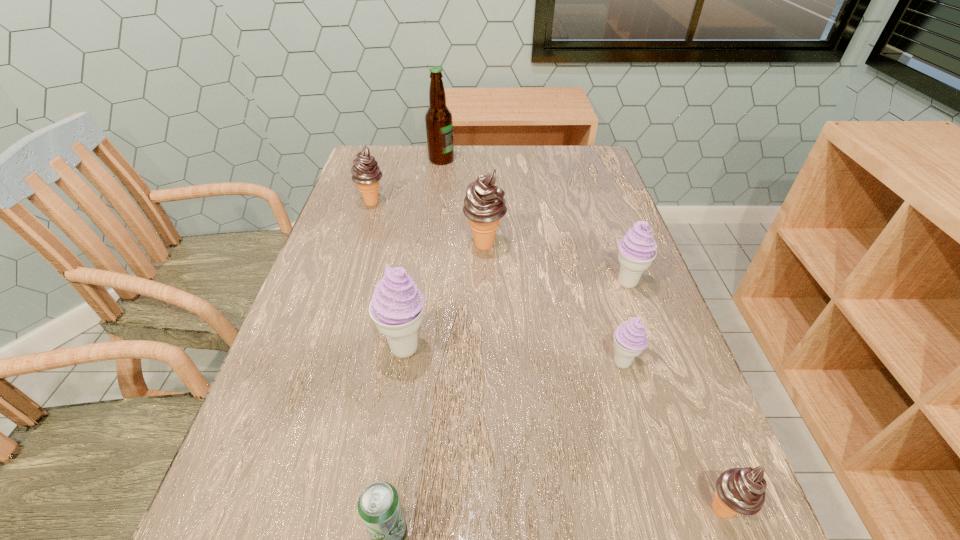
You are a GUI agent. You are given a task and a screenshot of the screen. Output one action in this format:
    pyautogui.click(x=<x>, y=<y>)
    Task: Click on the free point between the biggest chocolate icecream and the leftmost chocolate icecream
    This screenshot has height=540, width=960.
    Given the screenshot: What is the action you would take?
    pyautogui.click(x=428, y=224)

This screenshot has height=540, width=960. In order to click on vacant area that lies between the nearest icecream and the leftmost object in this screenshot , I will do `click(547, 356)`.

Choose which object is the second nearest neighbor to the third farthest icecream. Please provide its 2D coordinates. Your answer should be formatted as a tuple, i.e. [(x, y)], where the tuple contains the x and y coordinates of a point satisfying the conditions above.

[(484, 205)]

Image resolution: width=960 pixels, height=540 pixels. What are the coordinates of `the fourth closest object relative to the farthest purple icecream` in the screenshot? It's located at (738, 490).

Identify which icecream is located as the fifth nearest to the smallest purple icecream. Please provide its 2D coordinates. Your answer should be formatted as a tuple, i.e. [(x, y)], where the tuple contains the x and y coordinates of a point satisfying the conditions above.

[(366, 173)]

What are the coordinates of `icecream that is the third closest to the beer can` in the screenshot? It's located at (738, 490).

This screenshot has width=960, height=540. I want to click on the second closest chocolate icecream to the leftmost icecream, so click(x=738, y=490).

Identify which chocolate icecream is the second nearest to the leftmost icecream. Please provide its 2D coordinates. Your answer should be formatted as a tuple, i.e. [(x, y)], where the tuple contains the x and y coordinates of a point satisfying the conditions above.

[(738, 490)]

Identify which purple icecream is the second closest to the smallest purple icecream. Please provide its 2D coordinates. Your answer should be formatted as a tuple, i.e. [(x, y)], where the tuple contains the x and y coordinates of a point satisfying the conditions above.

[(397, 305)]

Where is `the second closest purple icecream to the beer bottle`? the second closest purple icecream to the beer bottle is located at coordinates (397, 305).